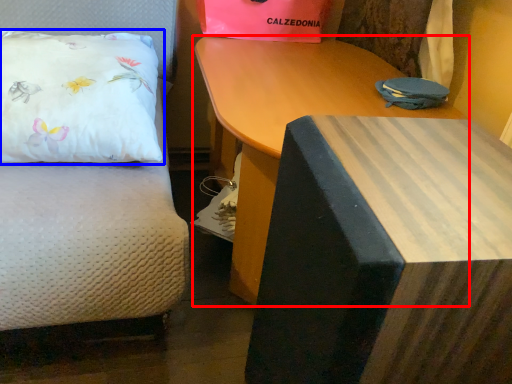
Question: Which point is further to the camera, table (highlighted by a red box) or pillow (highlighted by a blue box)?

Choices:
 (A) table
 (B) pillow

Answer: (B)